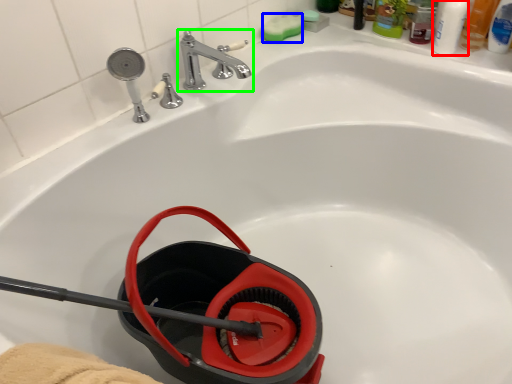
Question: Which object is the closest to the mouthwash (highlighted by a red box)? Choose among these: soap (highlighted by a blue box) or tap (highlighted by a green box).

Choices:
 (A) soap
 (B) tap

Answer: (A)